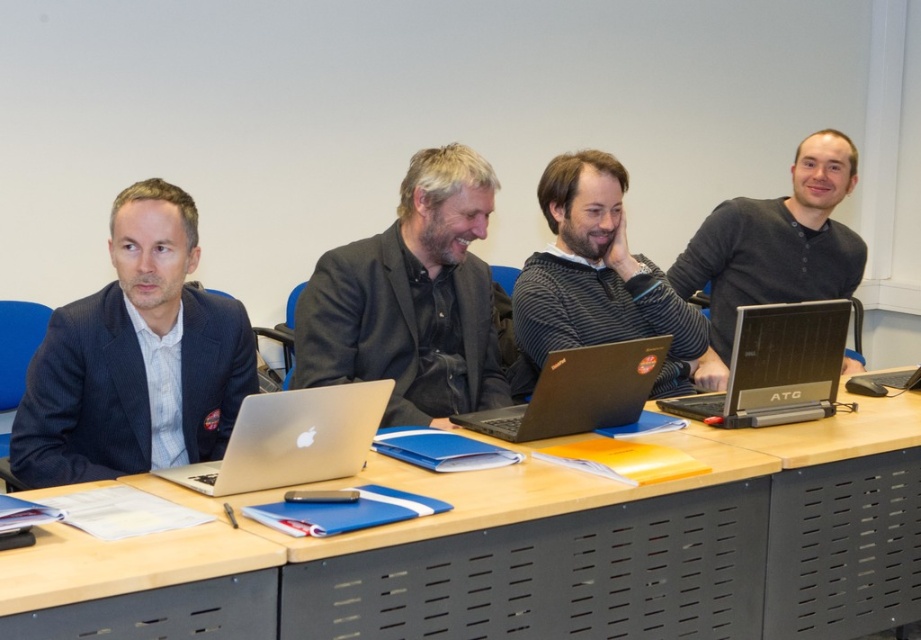
Question: Is black matte sweater at right closer to the viewer compared to black plastic laptop at right?

Choices:
 (A) yes
 (B) no

Answer: (B)

Question: Which point is closer to the camera?

Choices:
 (A) (783, 403)
 (B) (663, 349)
 (C) (224, 477)

Answer: (C)

Question: Can you confirm if silver metallic laptop at center is bigger than black matte laptop at center?

Choices:
 (A) yes
 (B) no

Answer: (B)

Question: Which object is positioned farthest from the silver metallic laptop at center?

Choices:
 (A) black matte laptop at center
 (B) black matte sweater at right

Answer: (B)

Question: Is striped sweater at center in front of black matte sweater at right?

Choices:
 (A) yes
 (B) no

Answer: (A)

Question: Among these points, which one is farthest from the camera?

Choices:
 (A) (710, 387)
 (B) (540, 406)

Answer: (A)